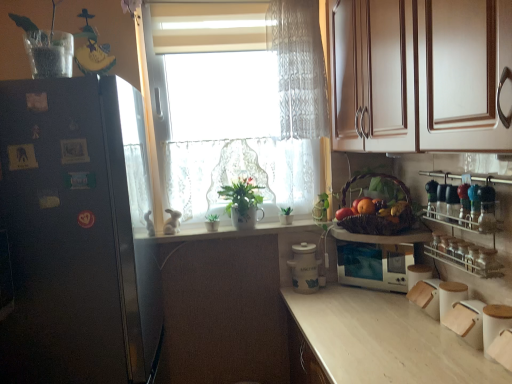
Question: Considering the relative sizes of green matte houseplant at center, the third houseplant when ordered from right to left, and clear glass spice rack at right in the image provided, is green matte houseplant at center, the third houseplant when ordered from right to left, smaller than clear glass spice rack at right?

Choices:
 (A) yes
 (B) no

Answer: (A)

Question: Are green matte houseplant at center, the 1th houseplant viewed from the left, and clear glass spice rack at right far apart?

Choices:
 (A) yes
 (B) no

Answer: (A)

Question: Does green matte houseplant at center, the 1th houseplant viewed from the left, have a lesser width compared to clear glass spice rack at right?

Choices:
 (A) no
 (B) yes

Answer: (B)

Question: Is green matte houseplant at center, the 1th houseplant viewed from the left, not inside clear glass spice rack at right?

Choices:
 (A) no
 (B) yes

Answer: (B)

Question: Is green matte houseplant at center, the 1th houseplant viewed from the left, aimed at clear glass spice rack at right?

Choices:
 (A) yes
 (B) no

Answer: (B)

Question: From a real-world perspective, is green matte houseplant at center, the third houseplant when ordered from right to left, located beneath clear glass spice rack at right?

Choices:
 (A) yes
 (B) no

Answer: (A)

Question: Is the depth of white glossy microwave at center, the first appliance positioned from the right, greater than that of white ceramic pots at center?

Choices:
 (A) yes
 (B) no

Answer: (B)

Question: Is the depth of white glossy microwave at center, positioned as the 2th appliance in left-to-right order, less than that of white ceramic pots at center?

Choices:
 (A) yes
 (B) no

Answer: (A)

Question: Is white glossy microwave at center, positioned as the 2th appliance in left-to-right order, thinner than white ceramic pots at center?

Choices:
 (A) no
 (B) yes

Answer: (A)

Question: Is white glossy microwave at center, positioned as the 2th appliance in left-to-right order, beside white ceramic pots at center?

Choices:
 (A) no
 (B) yes

Answer: (A)

Question: Is white glossy microwave at center, positioned as the 2th appliance in left-to-right order, outside white ceramic pots at center?

Choices:
 (A) no
 (B) yes

Answer: (B)

Question: Could black matte refrigerator at left be considered to be inside shiny red apple at right, the first fruit viewed from the left?

Choices:
 (A) no
 (B) yes

Answer: (A)